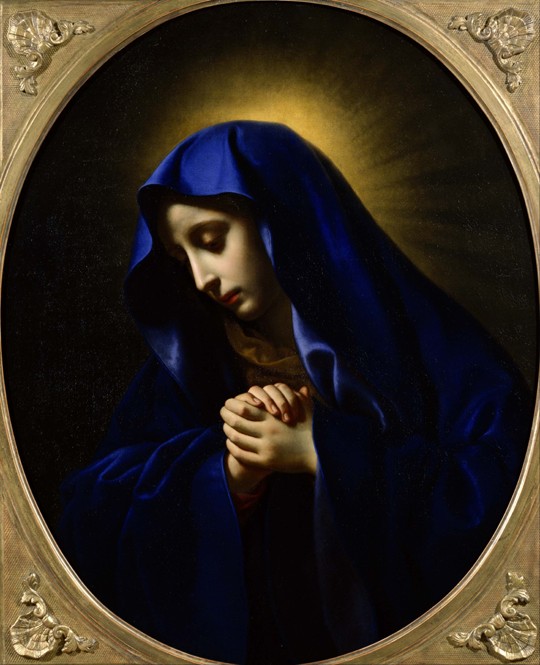
Where is `frame`? The width and height of the screenshot is (540, 665). frame is located at coordinates (9, 538), (510, 548), (9, 108), (534, 102).